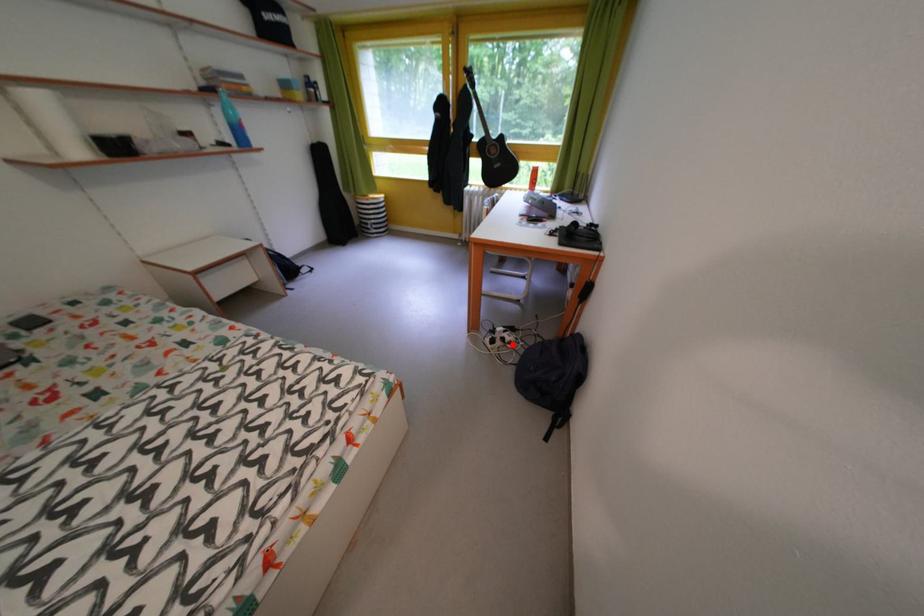
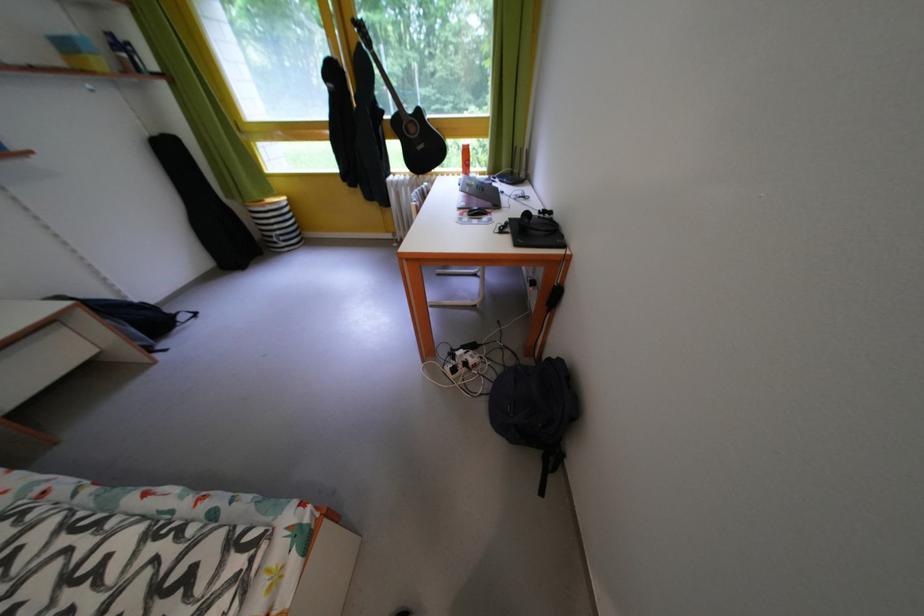
Question: I am providing you with two images of the same scene from different viewpoints. A red point is shown in image1. For the corresponding object point in image2, is it positioned nearer or farther from the camera?

Choices:
 (A) Nearer
 (B) Farther

Answer: (A)